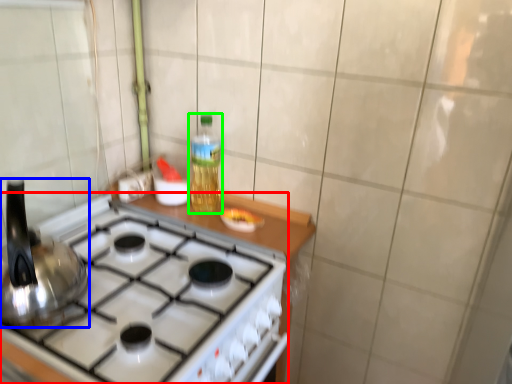
Question: Estimate the real-world distances between objects in this image. Which object is farther from gas stove (highlighted by a red box), kitchen appliance (highlighted by a blue box) or bottle (highlighted by a green box)?

Choices:
 (A) kitchen appliance
 (B) bottle

Answer: (B)